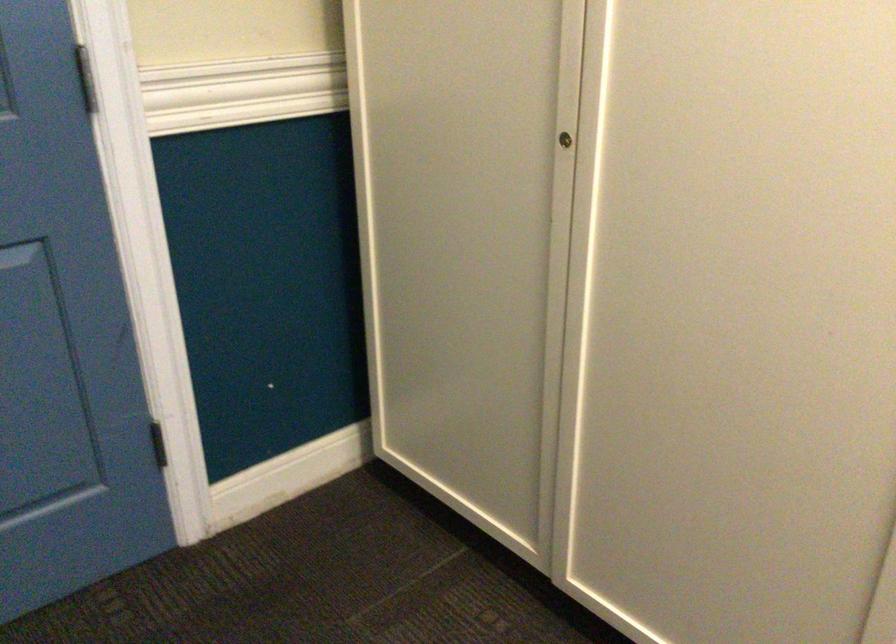
The image size is (896, 644). What do you see at coordinates (566, 137) in the screenshot?
I see `the cabinet door lock` at bounding box center [566, 137].